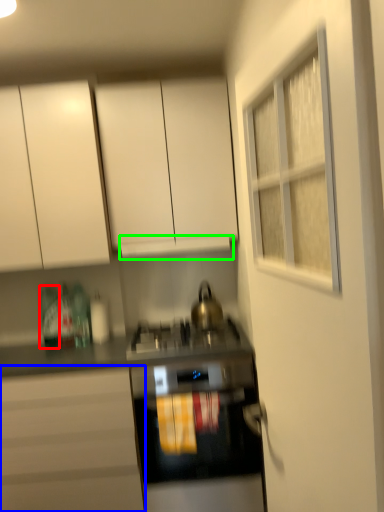
Question: Which is farther away from bottle (highlighted by a red box)? cabinetry (highlighted by a blue box) or exhaust hood (highlighted by a green box)?

Choices:
 (A) cabinetry
 (B) exhaust hood

Answer: (B)